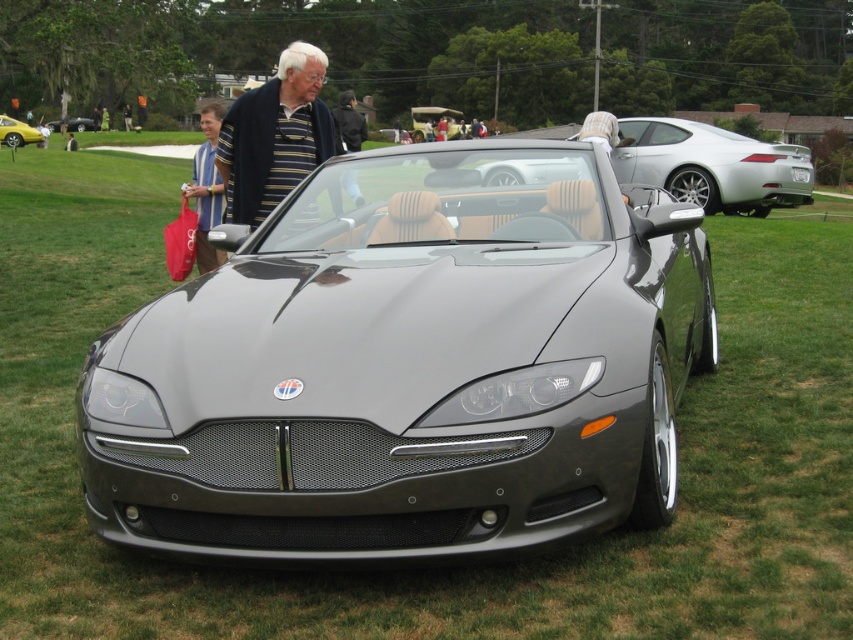
Is point (769, 168) closer to viewer compared to point (54, 125)?

That is True.

Find the location of a particular element. This screenshot has width=853, height=640. satin silver convertible at center is located at coordinates (712, 164).

Who is more forward, (665,147) or (57,122)?

Positioned in front is point (665,147).

Where is `satin silver convertible at center`? The width and height of the screenshot is (853, 640). satin silver convertible at center is located at coordinates (712, 164).

Is point (230, 132) in front of point (10, 128)?

Yes, point (230, 132) is in front of point (10, 128).

Does point (253, 172) come closer to viewer compared to point (0, 140)?

Yes, it is in front of point (0, 140).

Where is `striped sweater at center`? striped sweater at center is located at coordinates (274, 134).

Between yellow metallic car at upper left and matte black convertible at center, which one appears on the left side from the viewer's perspective?

Positioned to the left is matte black convertible at center.

Is yellow metallic car at upper left taller than matte black convertible at center?

Correct, yellow metallic car at upper left is much taller as matte black convertible at center.

Describe the element at coordinates (18, 132) in the screenshot. I see `yellow metallic car at upper left` at that location.

This screenshot has width=853, height=640. What are the coordinates of `yellow metallic car at upper left` in the screenshot? It's located at (18, 132).